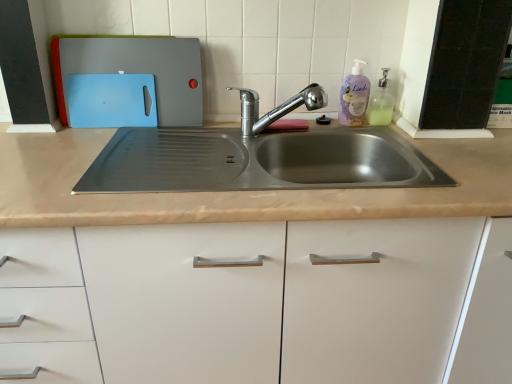
Question: Considering the relative positions of purple matte bottle at upper right and translucent plastic soap dispenser at upper right in the image provided, is purple matte bottle at upper right to the left of translucent plastic soap dispenser at upper right from the viewer's perspective?

Choices:
 (A) no
 (B) yes

Answer: (B)

Question: Does purple matte bottle at upper right have a greater height compared to translucent plastic soap dispenser at upper right?

Choices:
 (A) yes
 (B) no

Answer: (A)

Question: Does purple matte bottle at upper right have a lesser height compared to translucent plastic soap dispenser at upper right?

Choices:
 (A) yes
 (B) no

Answer: (B)

Question: Can you confirm if purple matte bottle at upper right is thinner than translucent plastic soap dispenser at upper right?

Choices:
 (A) no
 (B) yes

Answer: (B)

Question: From the image's perspective, is purple matte bottle at upper right over translucent plastic soap dispenser at upper right?

Choices:
 (A) yes
 (B) no

Answer: (A)

Question: Could you tell me if purple matte bottle at upper right is turned towards translucent plastic soap dispenser at upper right?

Choices:
 (A) no
 (B) yes

Answer: (A)

Question: Is purple matte bottle at upper right at the back of matte plastic cutting boards at upper left?

Choices:
 (A) yes
 (B) no

Answer: (B)

Question: From a real-world perspective, is matte plastic cutting boards at upper left located beneath purple matte bottle at upper right?

Choices:
 (A) yes
 (B) no

Answer: (B)

Question: Is matte plastic cutting boards at upper left bigger than purple matte bottle at upper right?

Choices:
 (A) no
 (B) yes

Answer: (B)

Question: Considering the relative positions of matte plastic cutting boards at upper left and purple matte bottle at upper right in the image provided, is matte plastic cutting boards at upper left to the left of purple matte bottle at upper right from the viewer's perspective?

Choices:
 (A) no
 (B) yes

Answer: (B)

Question: Is matte plastic cutting boards at upper left positioned far away from purple matte bottle at upper right?

Choices:
 (A) yes
 (B) no

Answer: (B)

Question: Is the depth of matte plastic cutting boards at upper left greater than that of purple matte bottle at upper right?

Choices:
 (A) yes
 (B) no

Answer: (B)

Question: From the image's perspective, is chrome metallic faucet at center located beneath matte plastic cutting boards at upper left?

Choices:
 (A) no
 (B) yes

Answer: (B)